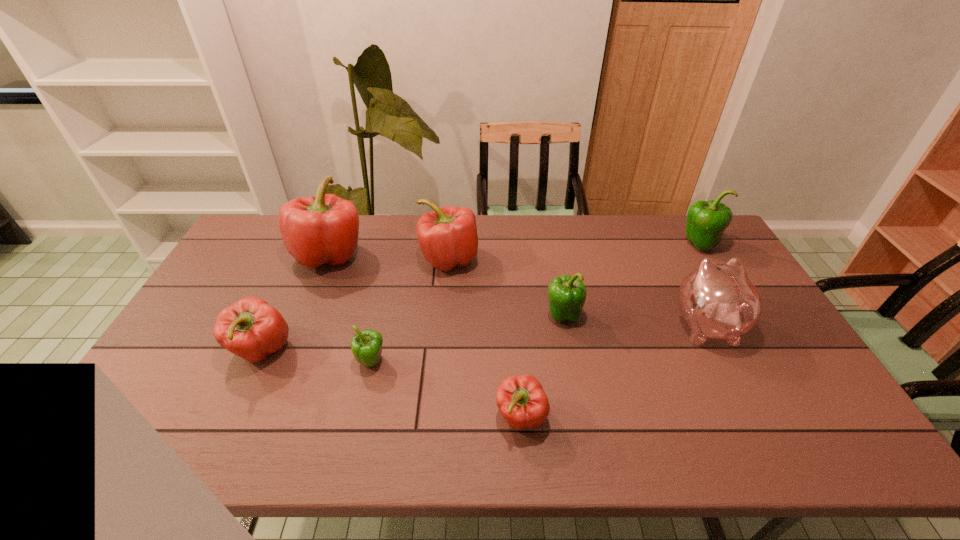
Locate an element on the screen. This screenshot has width=960, height=540. free space at the far left corner of the desktop is located at coordinates (259, 234).

You are a GUI agent. You are given a task and a screenshot of the screen. Output one action in this format:
    pyautogui.click(x=<x>, y=<y>)
    Task: Click on the vacant space at the far right corner of the desktop
    This screenshot has height=540, width=960.
    Given the screenshot: What is the action you would take?
    pyautogui.click(x=678, y=222)

Locate an element on the screen. This screenshot has width=960, height=540. unoccupied area between the third object from left to right and the fourth bell pepper from right to left is located at coordinates (410, 310).

Where is `vacant space that is in between the nearest object and the second bell pepper from right to left`? This screenshot has height=540, width=960. vacant space that is in between the nearest object and the second bell pepper from right to left is located at coordinates (541, 366).

At what (x,y) coordinates should I click in order to perform the action: click on empty space between the rightmost green bell pepper and the second pink bell pepper from right to left. Please return your answer as a coordinate pair (x, y). Image resolution: width=960 pixels, height=540 pixels. Looking at the image, I should click on (574, 252).

Where is `vacant point located between the sixth bell pepper from left to right and the fifth bell pepper from left to right`? The image size is (960, 540). vacant point located between the sixth bell pepper from left to right and the fifth bell pepper from left to right is located at coordinates (541, 366).

Find the location of a particular element. Image resolution: width=960 pixels, height=540 pixels. free area in between the piggy bank and the rightmost pink bell pepper is located at coordinates [x=613, y=371].

Where is `unoccupied position between the fourth bell pepper from right to left and the nearest bell pepper`? The image size is (960, 540). unoccupied position between the fourth bell pepper from right to left and the nearest bell pepper is located at coordinates pos(485,338).

Locate an element on the screen. free spot between the rightmost bell pepper and the biggest pink bell pepper is located at coordinates (514, 250).

Find the location of `blank region between the rightmost green bell pepper and the third object from right to left`. blank region between the rightmost green bell pepper and the third object from right to left is located at coordinates (631, 280).